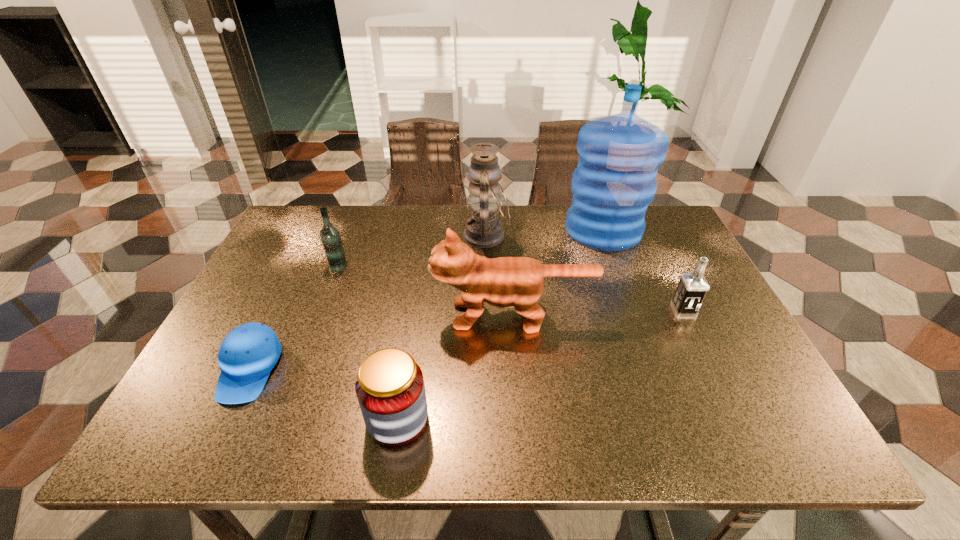
I want to click on the tallest object, so click(619, 155).

This screenshot has width=960, height=540. I want to click on the second tallest object, so click(483, 230).

At what (x,y) coordinates should I click in order to perform the action: click on the third tallest object. Please return your answer as a coordinate pair (x, y). The height and width of the screenshot is (540, 960). Looking at the image, I should click on (503, 282).

Find the location of a particular element. the farther vodka is located at coordinates (330, 236).

Identify the location of the left vodka. (330, 236).

I want to click on the nearer vodka, so click(x=692, y=288).

You are a GUI agent. You are given a task and a screenshot of the screen. Output one action in this format:
    pyautogui.click(x=<x>, y=<y>)
    Task: Click on the jar
    
    Given the screenshot: What is the action you would take?
    pyautogui.click(x=390, y=389)

Locate an element on the screen. the shortest object is located at coordinates (249, 352).

Locate an element on the screen. the leftmost object is located at coordinates (249, 352).

Identify the location of free region located on the front of the water jug. The width and height of the screenshot is (960, 540). (617, 268).